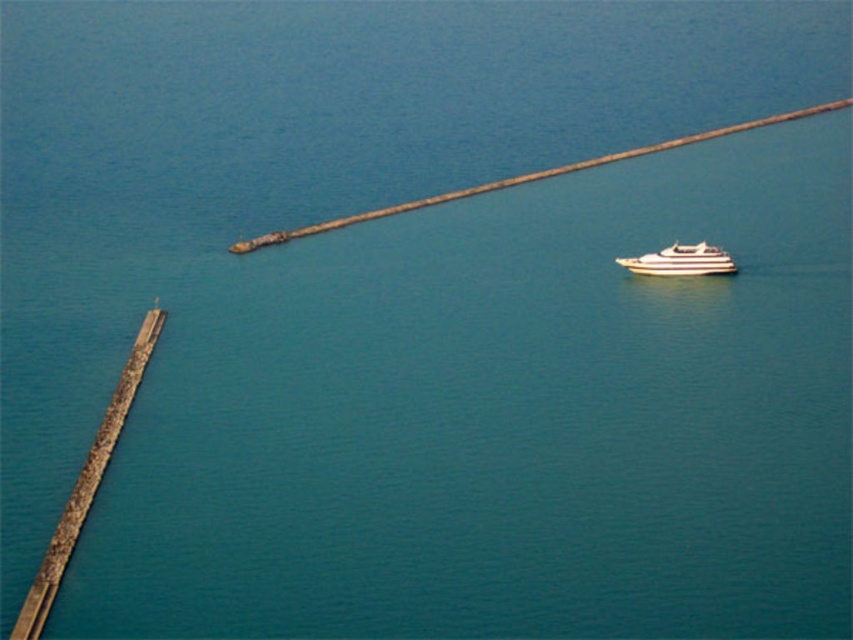
Can you confirm if gray concrete pier at left is smaller than white striped boat at right?

Actually, gray concrete pier at left might be larger than white striped boat at right.

Where is `gray concrete pier at left`? This screenshot has height=640, width=853. gray concrete pier at left is located at coordinates (86, 483).

What are the coordinates of `gray concrete pier at left` in the screenshot? It's located at (86, 483).